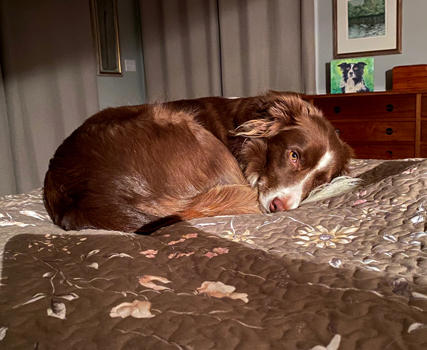
Identify the location of dresser. (368, 117).